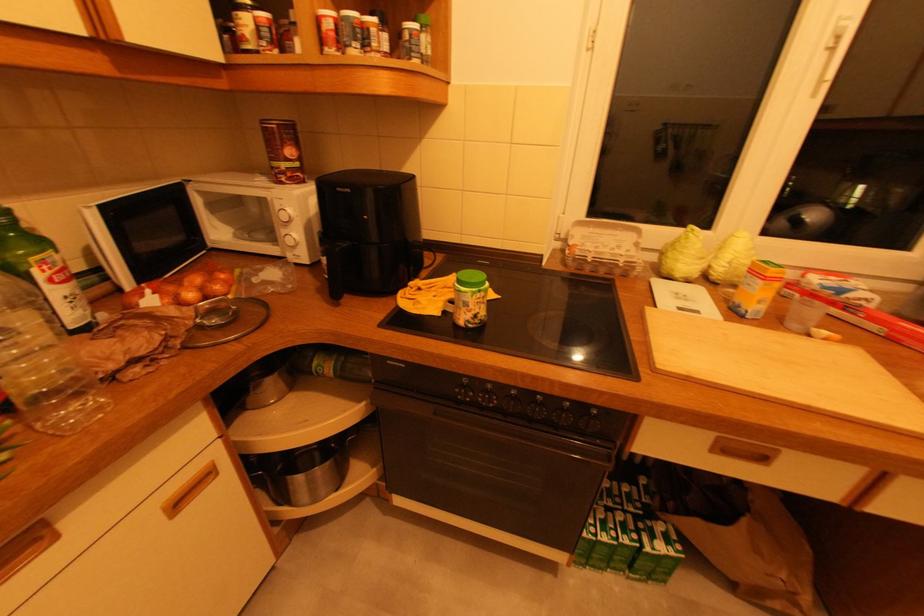
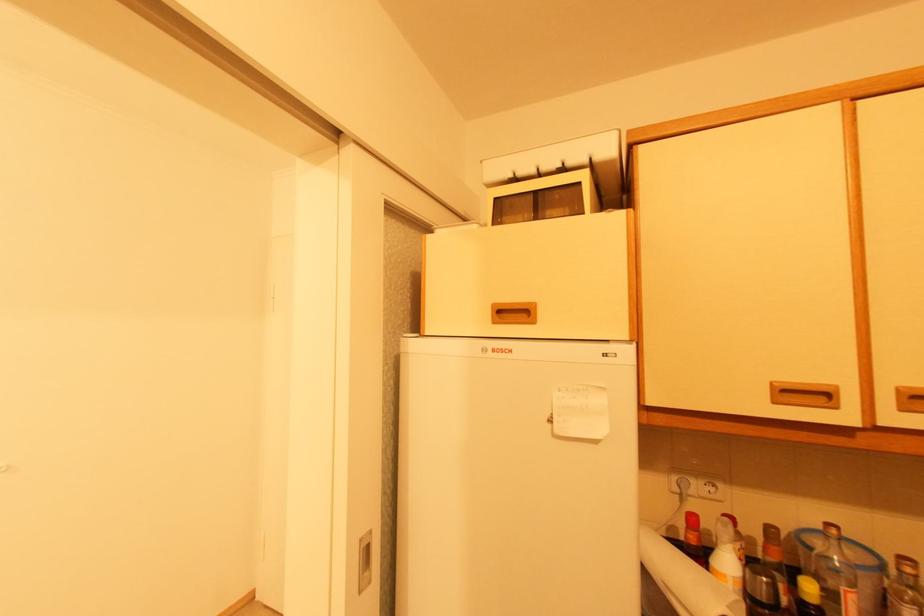
Question: The camera is either moving clockwise (left) or counter-clockwise (right) around the object. The first image is from the beginning of the video and the second image is from the end. Is the camera moving left or right when shooting the video?

Choices:
 (A) Left
 (B) Right

Answer: (B)